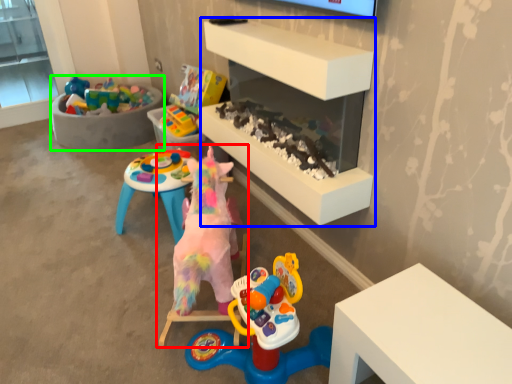
Question: Which object is positioned closest to toy (highlighted by a red box)? Select from shelf (highlighted by a blue box) and furniture (highlighted by a green box).

Choices:
 (A) shelf
 (B) furniture

Answer: (A)